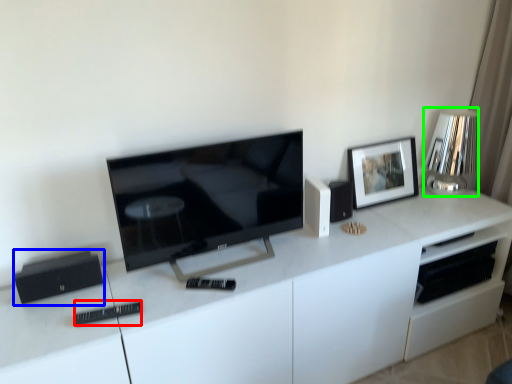
Question: Based on their relative distances, which object is nearer to remote (highlighted by a red box)? Choose from appliance (highlighted by a blue box) and lamp (highlighted by a green box).

Choices:
 (A) appliance
 (B) lamp

Answer: (A)